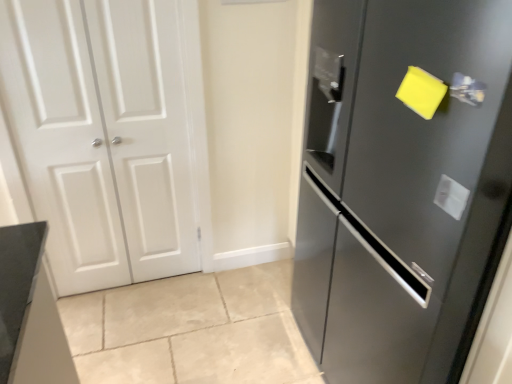
Question: From the image's perspective, is satin silver handle at upper right on satin black refrigerator at right, which is counted as the 1th door, starting from the right?

Choices:
 (A) yes
 (B) no

Answer: (A)

Question: From the image's perspective, would you say satin silver handle at upper right is shown under satin black refrigerator at right, which is counted as the 1th door, starting from the right?

Choices:
 (A) yes
 (B) no

Answer: (B)

Question: Does satin silver handle at upper right turn towards satin black refrigerator at right, which is counted as the 1th door, starting from the right?

Choices:
 (A) no
 (B) yes

Answer: (B)

Question: Is satin silver handle at upper right to the right of satin black refrigerator at right, which ranks as the second door in left-to-right order, from the viewer's perspective?

Choices:
 (A) yes
 (B) no

Answer: (B)

Question: Is satin silver handle at upper right looking in the opposite direction of satin black refrigerator at right, which ranks as the second door in left-to-right order?

Choices:
 (A) yes
 (B) no

Answer: (A)

Question: Is satin silver handle at upper right wider than satin black refrigerator at right, which ranks as the second door in left-to-right order?

Choices:
 (A) yes
 (B) no

Answer: (B)

Question: Does satin silver handle at upper right turn towards white matte door at left, the 1th door from the left?

Choices:
 (A) no
 (B) yes

Answer: (A)

Question: Can you confirm if satin silver handle at upper right is bigger than white matte door at left, which is the second door in right-to-left order?

Choices:
 (A) yes
 (B) no

Answer: (B)

Question: Can we say satin silver handle at upper right lies outside white matte door at left, which is the second door in right-to-left order?

Choices:
 (A) no
 (B) yes

Answer: (B)

Question: Is satin silver handle at upper right far away from white matte door at left, which is the second door in right-to-left order?

Choices:
 (A) no
 (B) yes

Answer: (B)

Question: From a real-world perspective, is satin silver handle at upper right located higher than white matte door at left, the 1th door from the left?

Choices:
 (A) no
 (B) yes

Answer: (B)

Question: From the image's perspective, is satin silver handle at upper right beneath white matte door at left, the 1th door from the left?

Choices:
 (A) no
 (B) yes

Answer: (A)

Question: Is white matte door at left, the 1th door from the left, not near satin black refrigerator at right, which is counted as the 1th door, starting from the right?

Choices:
 (A) no
 (B) yes

Answer: (B)